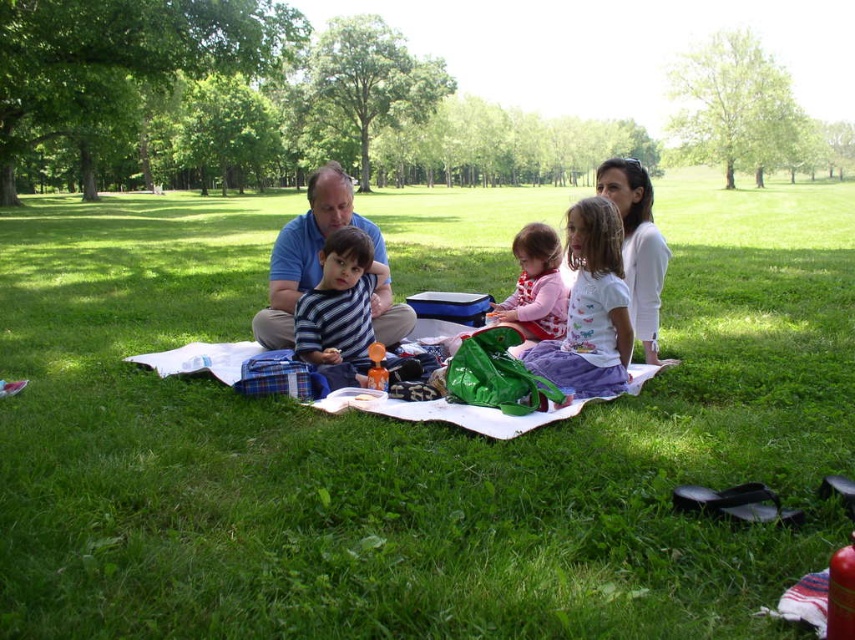
Question: Is blue cotton shirt at center below purple satin dress at center?

Choices:
 (A) no
 (B) yes

Answer: (A)

Question: Does green grass at center have a lesser width compared to blue cotton shirt at center?

Choices:
 (A) yes
 (B) no

Answer: (B)

Question: Which of the following is the farthest from the observer?

Choices:
 (A) (352, 276)
 (B) (604, 257)
 (C) (276, 280)
 (D) (376, 244)

Answer: (D)

Question: Which of the following is the closest to the observer?

Choices:
 (A) (602, 193)
 (B) (602, 339)
 (C) (762, 326)

Answer: (B)

Question: From the image, what is the correct spatial relationship of matte blue shirt at center in relation to striped fabric shirt at center?

Choices:
 (A) left
 (B) right

Answer: (A)

Question: Which of the following is the farthest from the observer?

Choices:
 (A) green grass at center
 (B) matte blue shirt at center
 (C) blue cotton shirt at center
 (D) striped fabric shirt at center

Answer: (B)